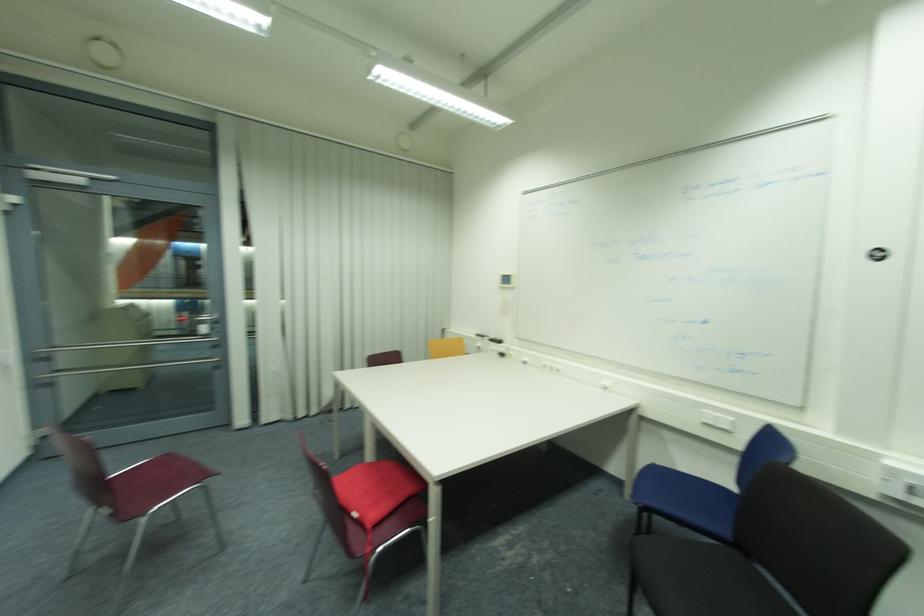
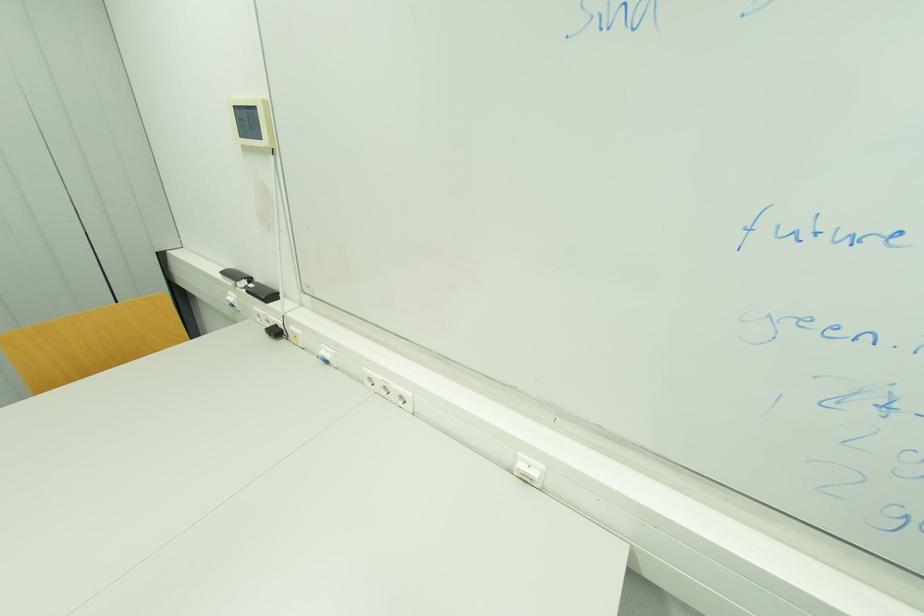
Locate, in the second image, the point that corresponds to point 506,355 in the first image.

(281, 333)